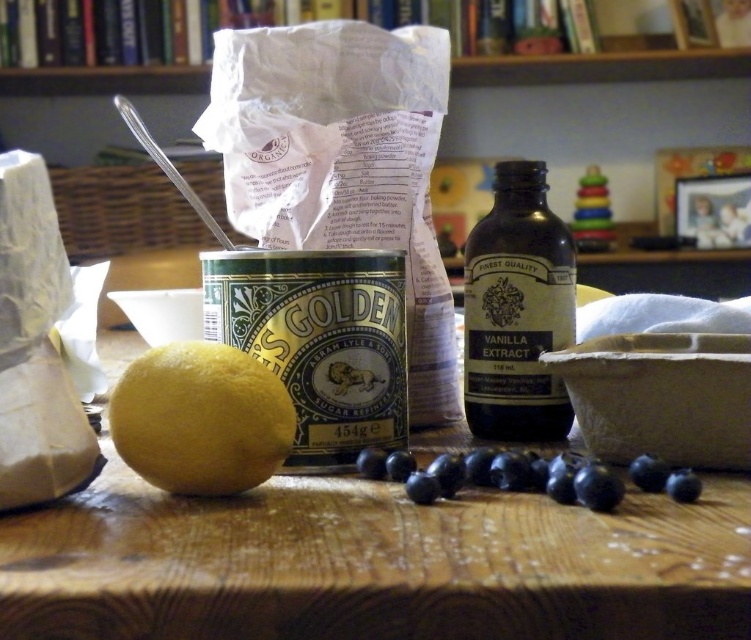
Question: Considering the relative positions of wooden table at center and blue matte blueberries at center in the image provided, where is wooden table at center located with respect to blue matte blueberries at center?

Choices:
 (A) below
 (B) above

Answer: (A)

Question: Is dark brown glass bottle at center wider than yellow matte lemon at center?

Choices:
 (A) yes
 (B) no

Answer: (B)

Question: From the image, what is the correct spatial relationship of wooden table at center in relation to blue matte blueberries at center?

Choices:
 (A) below
 (B) above

Answer: (A)

Question: Which point is farther to the camera?

Choices:
 (A) yellow matte lemon at center
 (B) wooden table at center
 (C) wooden bookshelf at upper center
 (D) dark brown glass bottle at center

Answer: (C)

Question: Which point appears farthest from the camera in this image?

Choices:
 (A) (516, 381)
 (B) (457, 509)

Answer: (A)

Question: Which of these objects is positioned farthest from the blue matte blueberries at center?

Choices:
 (A) wooden table at center
 (B) dark brown glass bottle at center
 (C) yellow matte lemon at center
 (D) wooden bookshelf at upper center

Answer: (D)